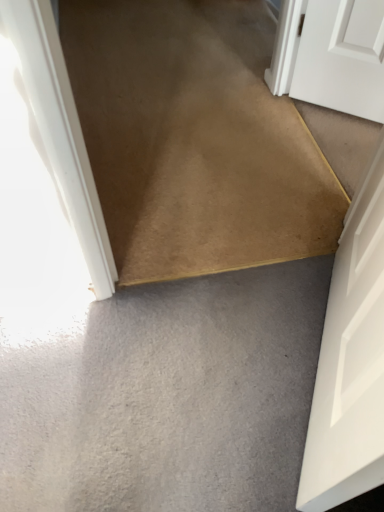
Question: From a real-world perspective, is carpet at center positioned under gray matte carpet at lower center based on gravity?

Choices:
 (A) yes
 (B) no

Answer: (A)

Question: Is carpet at center positioned far away from gray matte carpet at lower center?

Choices:
 (A) no
 (B) yes

Answer: (A)

Question: Is carpet at center facing towards gray matte carpet at lower center?

Choices:
 (A) no
 (B) yes

Answer: (B)

Question: From the image's perspective, does carpet at center appear lower than gray matte carpet at lower center?

Choices:
 (A) no
 (B) yes

Answer: (A)

Question: Would you say carpet at center contains gray matte carpet at lower center?

Choices:
 (A) no
 (B) yes

Answer: (A)

Question: Is carpet at center shorter than gray matte carpet at lower center?

Choices:
 (A) no
 (B) yes

Answer: (A)

Question: Can you confirm if white matte door at lower right is taller than carpet at center?

Choices:
 (A) yes
 (B) no

Answer: (A)

Question: Are white matte door at lower right and carpet at center making contact?

Choices:
 (A) yes
 (B) no

Answer: (B)

Question: From the image's perspective, is white matte door at lower right under carpet at center?

Choices:
 (A) no
 (B) yes

Answer: (B)

Question: Considering the relative sizes of white matte door at lower right and carpet at center in the image provided, is white matte door at lower right wider than carpet at center?

Choices:
 (A) no
 (B) yes

Answer: (A)

Question: From a real-world perspective, is white matte door at lower right below carpet at center?

Choices:
 (A) yes
 (B) no

Answer: (B)

Question: Is white matte door at lower right shorter than carpet at center?

Choices:
 (A) no
 (B) yes

Answer: (A)

Question: Is white matte door at lower right oriented away from gray matte carpet at lower center?

Choices:
 (A) no
 (B) yes

Answer: (A)